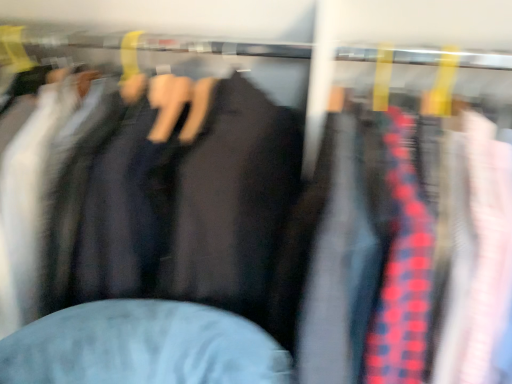
Identify the location of matte black jacket at center. This screenshot has width=512, height=384. (185, 207).

Describe the element at coordinates (185, 207) in the screenshot. I see `matte black jacket at center` at that location.

What do you see at coordinates (408, 256) in the screenshot? I see `red plaid shirt at right` at bounding box center [408, 256].

At what (x,y) coordinates should I click in order to perform the action: click on red plaid shirt at right. Please return your answer as a coordinate pair (x, y). The width and height of the screenshot is (512, 384). Looking at the image, I should click on (408, 256).

Image resolution: width=512 pixels, height=384 pixels. Identify the location of matte black jacket at center. (185, 207).

Based on their positions, is red plaid shirt at right located to the left or right of matte black jacket at center?

In the image, red plaid shirt at right appears on the right side of matte black jacket at center.

Relative to matte black jacket at center, is red plaid shirt at right in front or behind?

red plaid shirt at right is positioned closer to the viewer than matte black jacket at center.

Is point (483, 185) closer or farther from the camera than point (244, 246)?

Point (483, 185).

From the image's perspective, which object appears higher, red plaid shirt at right or matte black jacket at center?

matte black jacket at center.

From a real-world perspective, which object rests below the other?

red plaid shirt at right, from a real-world perspective.

Can you confirm if red plaid shirt at right is thinner than matte black jacket at center?

Correct, the width of red plaid shirt at right is less than that of matte black jacket at center.

Between red plaid shirt at right and matte black jacket at center, which one has more height?

Standing taller between the two is red plaid shirt at right.

Considering the sizes of red plaid shirt at right and matte black jacket at center in the image, is red plaid shirt at right bigger or smaller than matte black jacket at center?

Clearly, red plaid shirt at right is smaller in size than matte black jacket at center.

Do you think red plaid shirt at right is within matte black jacket at center, or outside of it?

red plaid shirt at right is not inside matte black jacket at center, it's outside.

Is red plaid shirt at right not near matte black jacket at center?

No, red plaid shirt at right is not far away from matte black jacket at center.

Is red plaid shirt at right positioned with its back to matte black jacket at center?

red plaid shirt at right is not turned away from matte black jacket at center.

How many degrees apart are the facing directions of red plaid shirt at right and matte black jacket at center?

5.05e-06 degrees.

Find the location of a particular element. jacket above the red plaid shirt at right (from the image's perspective) is located at coordinates (185, 207).

Considering the relative positions of matte black jacket at center and red plaid shirt at right in the image provided, is matte black jacket at center to the right of red plaid shirt at right from the viewer's perspective?

Incorrect, matte black jacket at center is not on the right side of red plaid shirt at right.

Relative to red plaid shirt at right, is matte black jacket at center in front or behind?

Visually, matte black jacket at center is located behind red plaid shirt at right.

Which is less distant, (239, 198) or (468, 258)?

Point (239, 198).

From the image's perspective, who appears lower, matte black jacket at center or red plaid shirt at right?

From the image's view, red plaid shirt at right is below.

From a real-world perspective, which object stands above the other?

matte black jacket at center.

Does matte black jacket at center have a greater width compared to red plaid shirt at right?

Yes.

Looking at this image, considering the sizes of objects matte black jacket at center and red plaid shirt at right in the image provided, who is shorter, matte black jacket at center or red plaid shirt at right?

matte black jacket at center is shorter.

Does matte black jacket at center have a larger size compared to red plaid shirt at right?

Correct, matte black jacket at center is larger in size than red plaid shirt at right.

Is matte black jacket at center not within red plaid shirt at right?

matte black jacket at center is positioned outside red plaid shirt at right.

Is matte black jacket at center in contact with red plaid shirt at right?

No.

Could you tell me if matte black jacket at center is facing red plaid shirt at right?

No, matte black jacket at center is not aimed at red plaid shirt at right.

How different are the orientations of matte black jacket at center and red plaid shirt at right in degrees?

The facing directions of matte black jacket at center and red plaid shirt at right are 5.05e-06 degrees apart.

This screenshot has width=512, height=384. Find the location of `clothing below the matte black jacket at center (from the image's perspective)`. clothing below the matte black jacket at center (from the image's perspective) is located at coordinates (408, 256).

Locate an element on the screen. This screenshot has height=384, width=512. jacket that is behind the red plaid shirt at right is located at coordinates pyautogui.click(x=185, y=207).

You are a GUI agent. You are given a task and a screenshot of the screen. Output one action in this format:
    pyautogui.click(x=<x>, y=<y>)
    Task: Click on the jacket that is above the red plaid shirt at right (from the image's perspective)
    
    Given the screenshot: What is the action you would take?
    pyautogui.click(x=185, y=207)